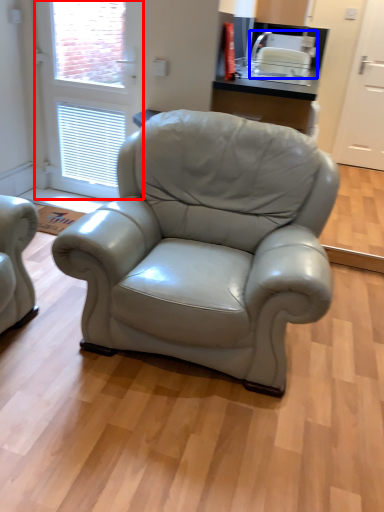
Question: Among these objects, which one is nearest to the camera, screen door (highlighted by a red box) or appliance (highlighted by a blue box)?

Choices:
 (A) screen door
 (B) appliance

Answer: (A)